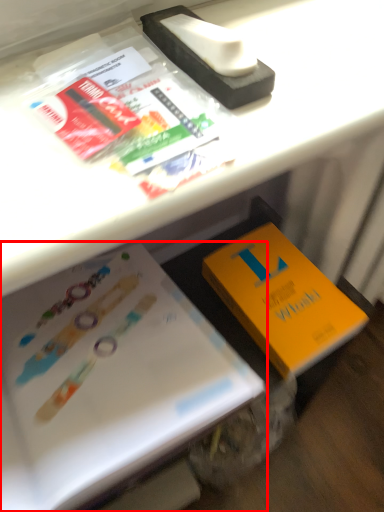
Question: From the image's perspective, what is the correct spatial relationship of book (annotated by the red box) in relation to book?

Choices:
 (A) below
 (B) above

Answer: (A)